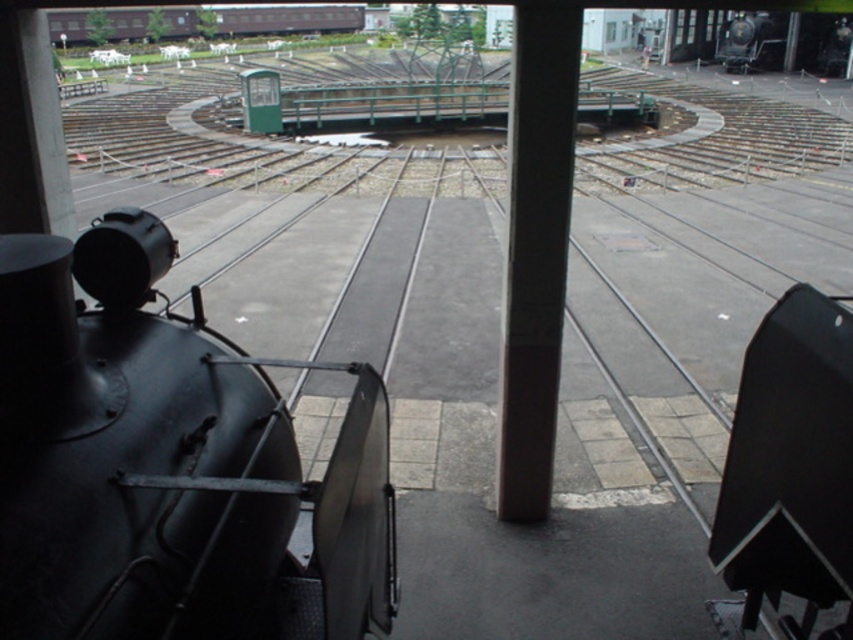
You are a passenger on the brown wooden train car at upper left and want to get to the smooth gray pole at center. Which direction should you move to reach it?

The smooth gray pole at center is in front of the brown wooden train car at upper left, so you should move forward to reach it.

You are a maintenance worker needing to access the matte black steam engine at left for repairs. You notice a smooth gray pole at center overhead. Is the pole directly above the engine or offset to the side?

The matte black steam engine at left is positioned under the smooth gray pole at center, so the pole is directly above the engine.